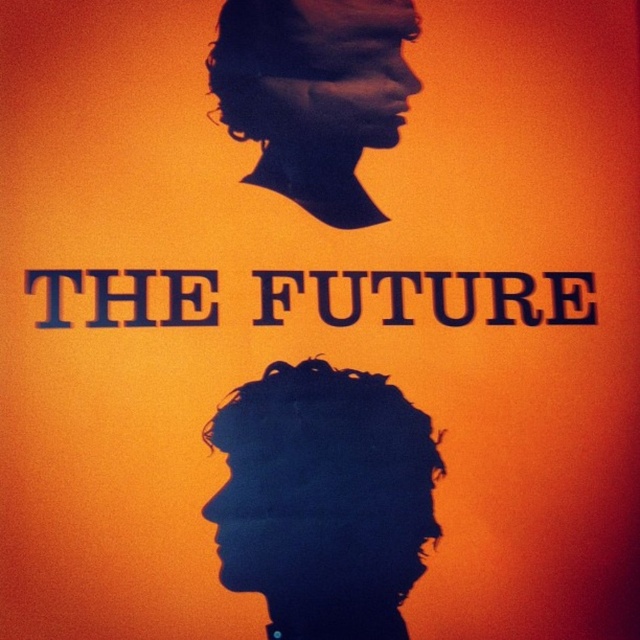
You are an artist analyzing the composition of this image. You notice the dark blue textured hair at lower center. Where exactly is it located in the image coordinates?

The dark blue textured hair at lower center is located at point coordinates of (323, 499).

You are an artist analyzing this image. You notice the dark blue textured hair at lower center and the black matte profile at upper center. Which object is positioned lower in the image?

The dark blue textured hair at lower center is positioned below the black matte profile at upper center, so it is the lower one.